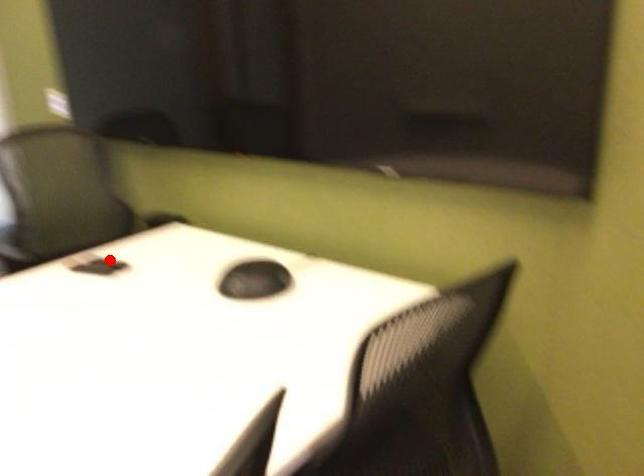
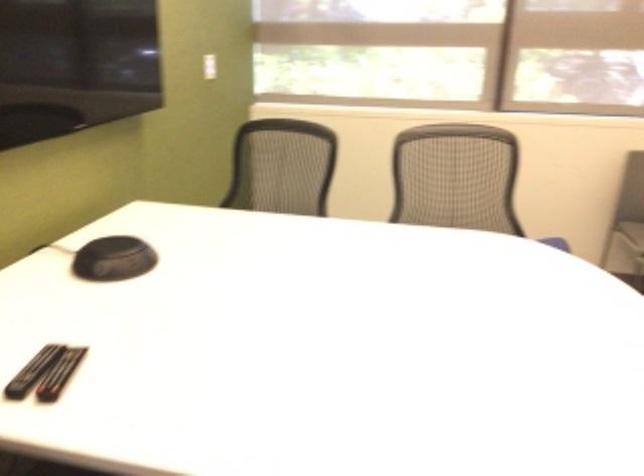
The point at the highlighted location is marked in the first image. Where is the corresponding point in the second image?

(32, 371)